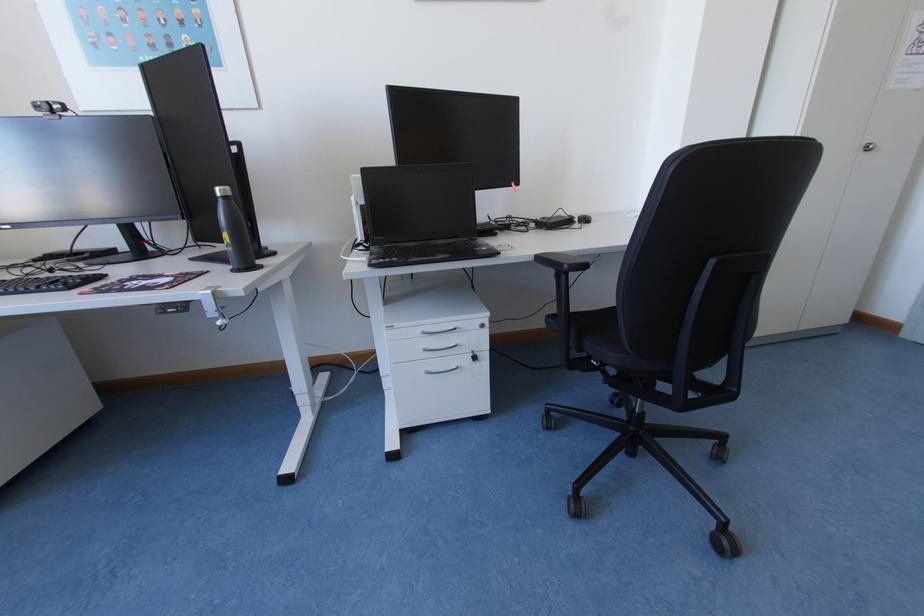
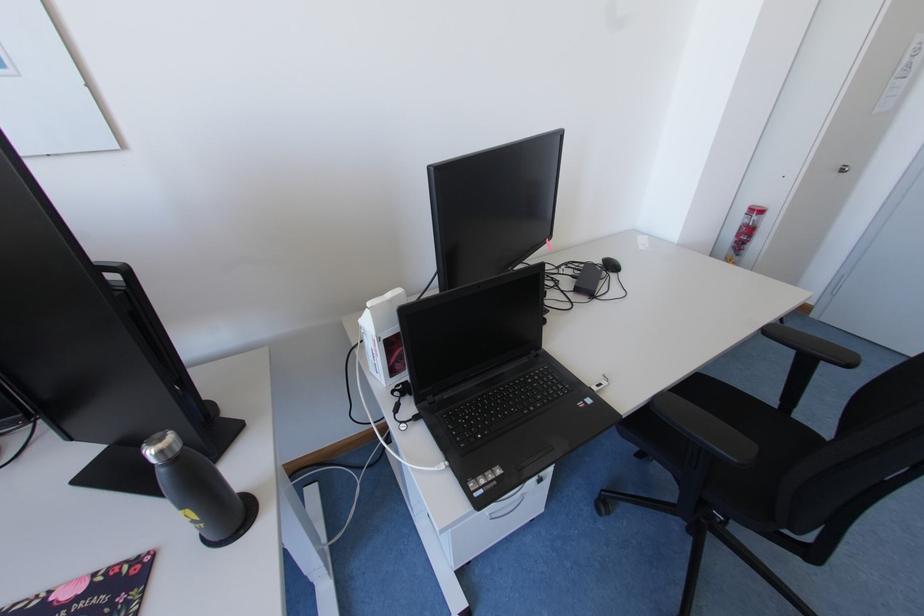
Question: The camera is either moving clockwise (left) or counter-clockwise (right) around the object. The first image is from the beginning of the video and the second image is from the end. Is the camera moving left or right when shooting the video?

Choices:
 (A) Left
 (B) Right

Answer: (A)